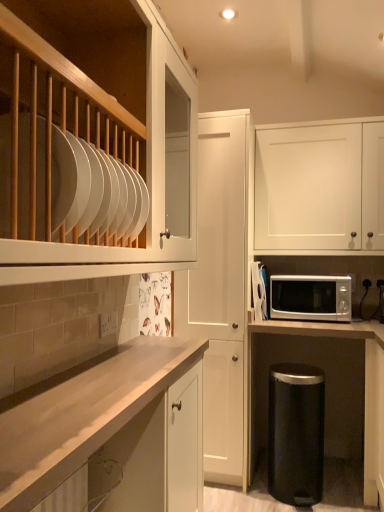
Question: Should I look upward or downward to see white matte cabinet at center, which is the 2th cabinetry from right to left?

Choices:
 (A) up
 (B) down

Answer: (B)

Question: Could white matte cabinet at upper right, the first cabinetry positioned from the back, be considered to be inside black matte trash can at lower right?

Choices:
 (A) yes
 (B) no

Answer: (B)

Question: Is black matte trash can at lower right far away from white matte cabinet at upper right, the first cabinetry positioned from the back?

Choices:
 (A) no
 (B) yes

Answer: (B)

Question: Is black matte trash can at lower right turned away from white matte cabinet at upper right, acting as the 3th cabinetry starting from the left?

Choices:
 (A) no
 (B) yes

Answer: (A)

Question: Can you confirm if black matte trash can at lower right is smaller than white matte cabinet at upper right, the first cabinetry positioned from the back?

Choices:
 (A) no
 (B) yes

Answer: (B)

Question: Is black matte trash can at lower right at the right side of white matte cabinet at upper right, the third cabinetry in the front-to-back sequence?

Choices:
 (A) yes
 (B) no

Answer: (B)

Question: Is black matte trash can at lower right positioned beyond the bounds of white matte cabinet at upper right, the third cabinetry in the front-to-back sequence?

Choices:
 (A) no
 (B) yes

Answer: (B)

Question: Can light wood countertop at center, marked as the first cabinetry in a front-to-back arrangement, be found inside white matte cabinet at upper right, acting as the 3th cabinetry starting from the left?

Choices:
 (A) no
 (B) yes

Answer: (A)

Question: Is white matte cabinet at upper right, the first cabinetry positioned from the back, at the right side of light wood countertop at center, positioned as the 1th cabinetry in left-to-right order?

Choices:
 (A) no
 (B) yes

Answer: (B)

Question: Could you tell me if white matte cabinet at upper right, the first cabinetry positioned from the back, is facing light wood countertop at center, positioned as the 1th cabinetry in left-to-right order?

Choices:
 (A) yes
 (B) no

Answer: (B)

Question: Is white matte cabinet at upper right, acting as the 1th cabinetry starting from the right, closer to the viewer compared to light wood countertop at center, positioned as the 1th cabinetry in left-to-right order?

Choices:
 (A) no
 (B) yes

Answer: (A)

Question: Is white matte cabinet at upper right, acting as the 3th cabinetry starting from the left, bigger than light wood countertop at center, the third cabinetry in the right-to-left sequence?

Choices:
 (A) no
 (B) yes

Answer: (A)

Question: Does white matte cabinet at upper right, the first cabinetry positioned from the back, have a lesser height compared to light wood countertop at center, marked as the first cabinetry in a front-to-back arrangement?

Choices:
 (A) yes
 (B) no

Answer: (B)

Question: Is white matte cabinet at center, the second cabinetry when ordered from front to back, positioned with its back to silver metallic microwave at lower right?

Choices:
 (A) no
 (B) yes

Answer: (A)